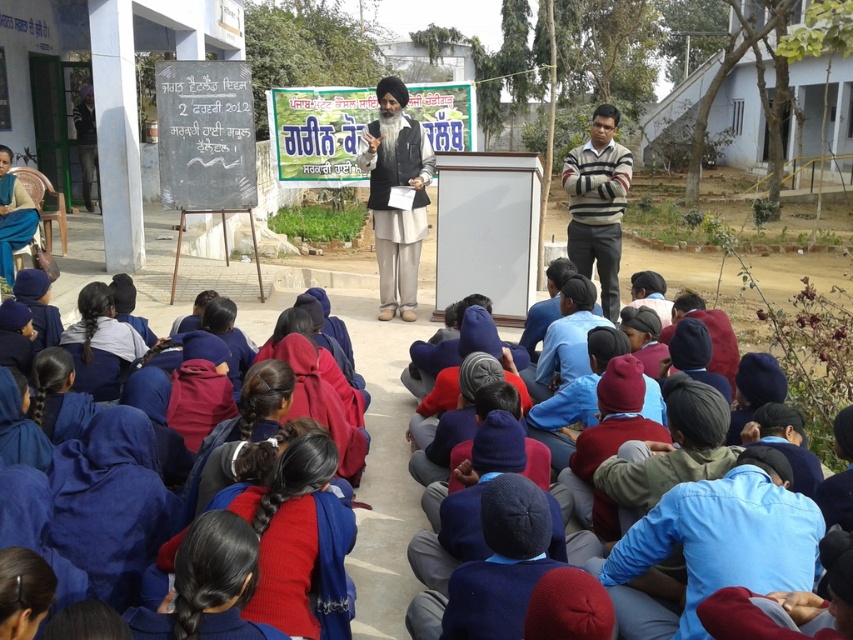
Question: Which of these objects is positioned farthest from the blue cotton shirt at lower right?

Choices:
 (A) black chalkboard at upper center
 (B) striped sweater at right
 (C) light beige fabric turban at center

Answer: (A)

Question: Is blue cotton shirt at lower right thinner than black chalkboard at upper center?

Choices:
 (A) yes
 (B) no

Answer: (A)

Question: Which object is farther from the camera taking this photo?

Choices:
 (A) striped sweater at right
 (B) black chalkboard at upper center
 (C) light beige fabric turban at center
 (D) blue cotton shirt at lower right

Answer: (B)

Question: Which is farther from the striped sweater at right?

Choices:
 (A) black chalkboard at upper center
 (B) blue cotton shirt at lower right

Answer: (B)

Question: Where is light beige fabric turban at center located in relation to striped sweater at right in the image?

Choices:
 (A) above
 (B) below

Answer: (A)

Question: Does light beige fabric turban at center have a lesser width compared to striped sweater at right?

Choices:
 (A) no
 (B) yes

Answer: (A)